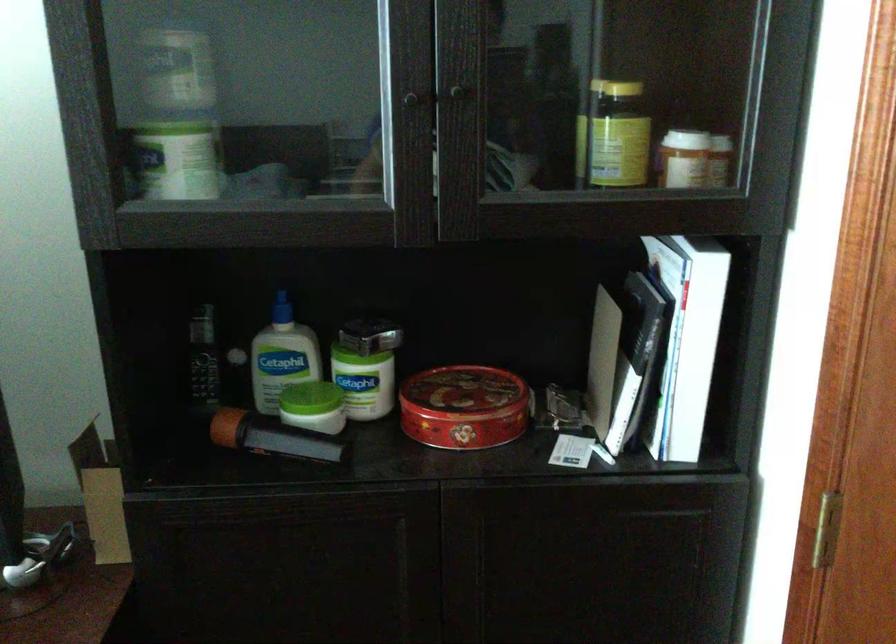
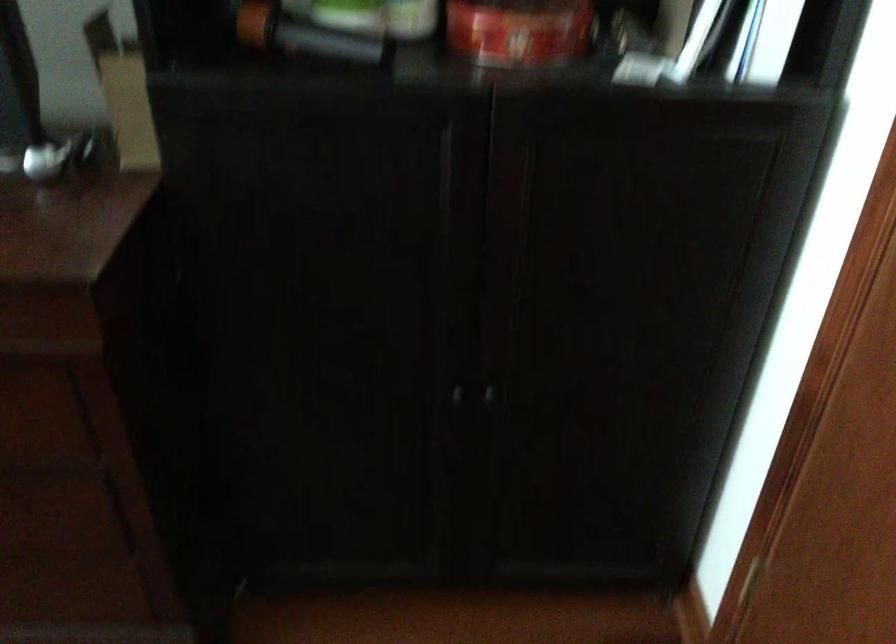
Locate, in the second image, the point that corresponds to [271,444] in the first image.

(304, 35)